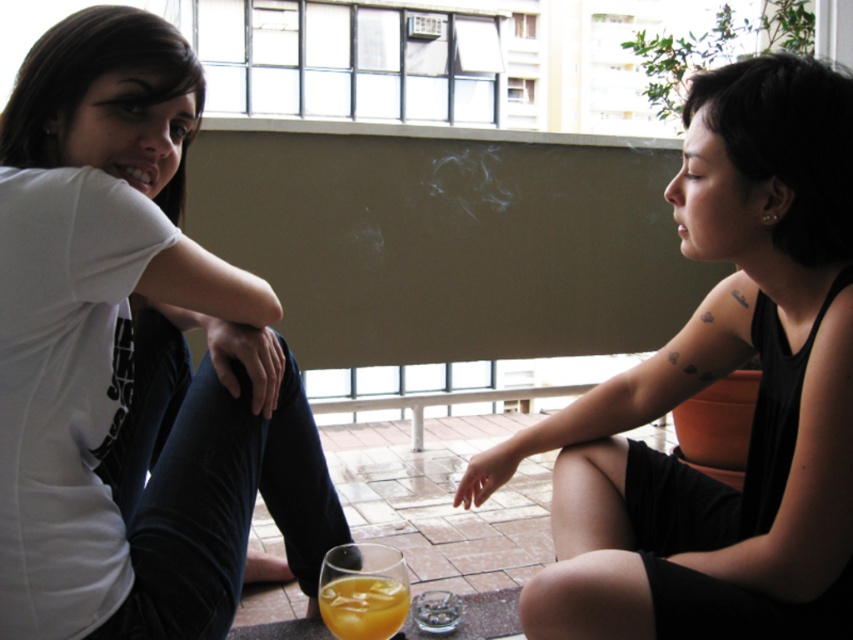
You are standing on the balcony and want to determine the relative positions of two points marked on the floor. Which point is closer to you, point (775, 177) or point (50, 285)?

Point (50, 285) is closer to you because it is less further to the camera than point (775, 177).